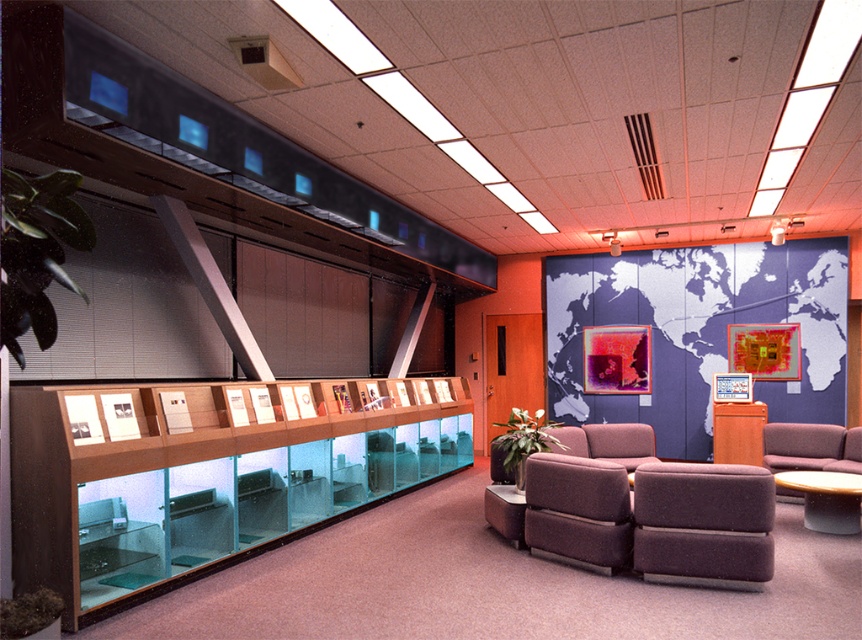
You are an interior designer planning to move the dark brown fabric armchair at lower right closer to the clear glass display case at left. Considering their widths, will the armchair fit snugly next to the display case without overlapping?

The clear glass display case at left might be wider than dark brown fabric armchair at lower right, so there might be enough space for the armchair to fit next to it without overlapping, but it depends on the exact dimensions.

You are a visitor in this room and need to place a small package on the clear glass display case at left. However, you are currently standing next to the dark brown fabric armchair at lower right. Can you easily reach the display case from your current position without moving the armchair?

The clear glass display case at left is located above the dark brown fabric armchair at lower right, so you can easily reach it without moving the armchair since it is positioned above it.